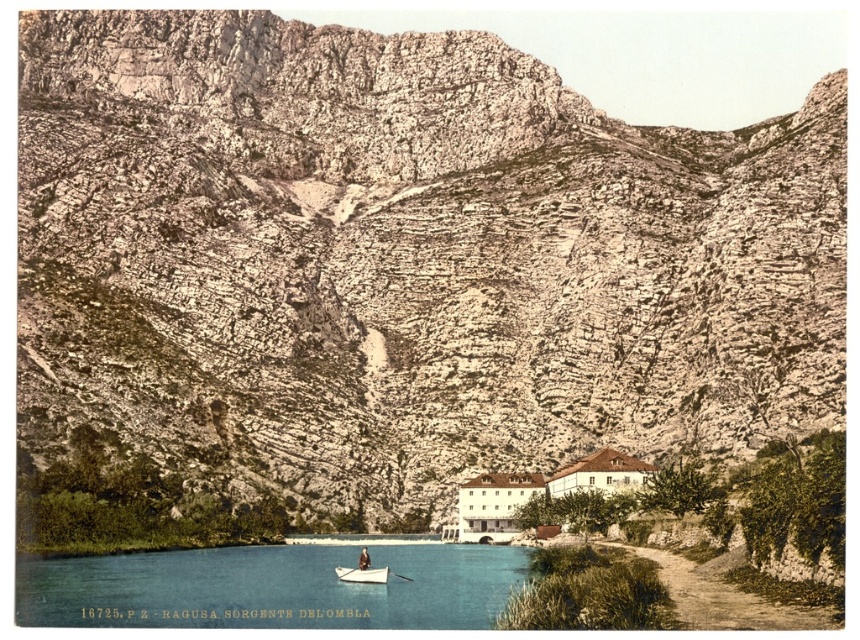
Is white matte boat at lower center to the right of dark brown leather jacket at center from the viewer's perspective?

Indeed, white matte boat at lower center is positioned on the right side of dark brown leather jacket at center.

Can you confirm if white matte boat at lower center is taller than dark brown leather jacket at center?

No.

The height and width of the screenshot is (640, 860). What do you see at coordinates (361, 573) in the screenshot?
I see `white matte boat at lower center` at bounding box center [361, 573].

Image resolution: width=860 pixels, height=640 pixels. I want to click on white matte boat at lower center, so click(361, 573).

Between point (379, 566) and point (395, 572), which one is positioned in front?

Positioned in front is point (395, 572).

Identify the location of white matte boat at lower center. This screenshot has height=640, width=860. (361, 573).

Does blue glassy river at lower center lie in front of dark brown leather jacket at center?

Yes, blue glassy river at lower center is in front of dark brown leather jacket at center.

Locate an element on the screen. The height and width of the screenshot is (640, 860). blue glassy river at lower center is located at coordinates (271, 588).

Find the location of a particular element. The height and width of the screenshot is (640, 860). blue glassy river at lower center is located at coordinates (271, 588).